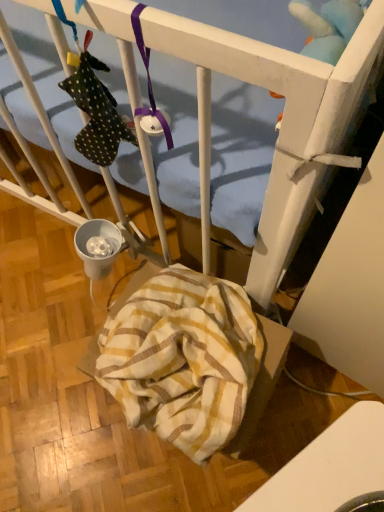
Question: Is point (317, 58) positioned closer to the camera than point (357, 461)?

Choices:
 (A) farther
 (B) closer

Answer: (A)

Question: From the image's perspective, is blue plush toy at upper right located above or below white glossy table at lower right?

Choices:
 (A) above
 (B) below

Answer: (A)

Question: Which object is positioned farthest from the blue plush toy at upper right?

Choices:
 (A) white glossy table at lower right
 (B) yellow striped fabric at lower center

Answer: (A)

Question: Which object is positioned farthest from the blue plush toy at upper right?

Choices:
 (A) white glossy table at lower right
 (B) yellow striped fabric at lower center

Answer: (A)